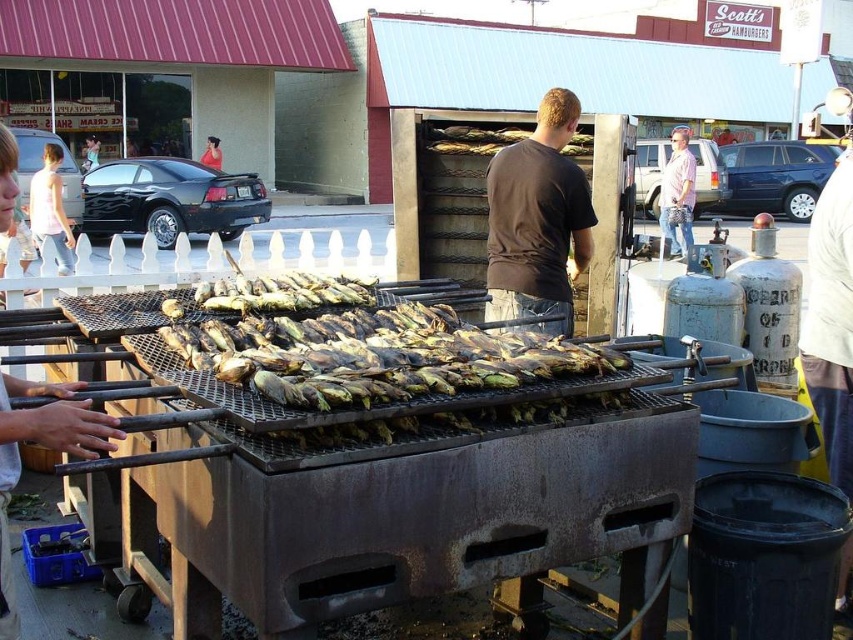
Consider the image. Is charred corn at center positioned in front of dark brown shirt at center?

Yes, it is in front of dark brown shirt at center.

How far apart are charred corn at center and dark brown shirt at center?

The distance of charred corn at center from dark brown shirt at center is 4.05 feet.

What do you see at coordinates (357, 349) in the screenshot? I see `charred corn at center` at bounding box center [357, 349].

The image size is (853, 640). I want to click on charred corn at center, so click(357, 349).

Which is more to the right, charred corn at center or pink cotton shirt at center?

From the viewer's perspective, pink cotton shirt at center appears more on the right side.

Who is more distant from viewer, (527, 337) or (672, 179)?

The point (672, 179) is more distant.

Find the location of a particular element. charred corn at center is located at coordinates (357, 349).

Does dark brown shirt at center have a greater height compared to pink cotton shirt at center?

Yes, dark brown shirt at center is taller than pink cotton shirt at center.

Does dark brown shirt at center appear on the left side of pink cotton shirt at center?

Correct, you'll find dark brown shirt at center to the left of pink cotton shirt at center.

The image size is (853, 640). What do you see at coordinates (537, 218) in the screenshot?
I see `dark brown shirt at center` at bounding box center [537, 218].

Where is `dark brown shirt at center`? dark brown shirt at center is located at coordinates pos(537,218).